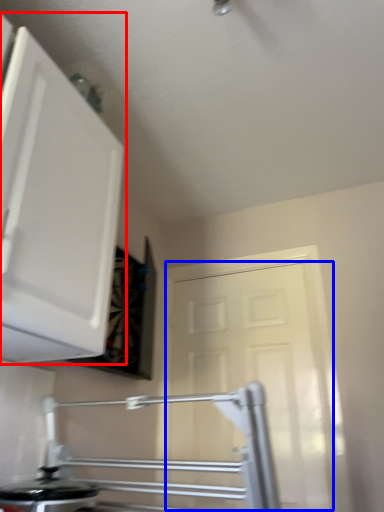
Question: Among these objects, which one is nearest to the camera, cabinetry (highlighted by a red box) or door (highlighted by a blue box)?

Choices:
 (A) cabinetry
 (B) door

Answer: (A)